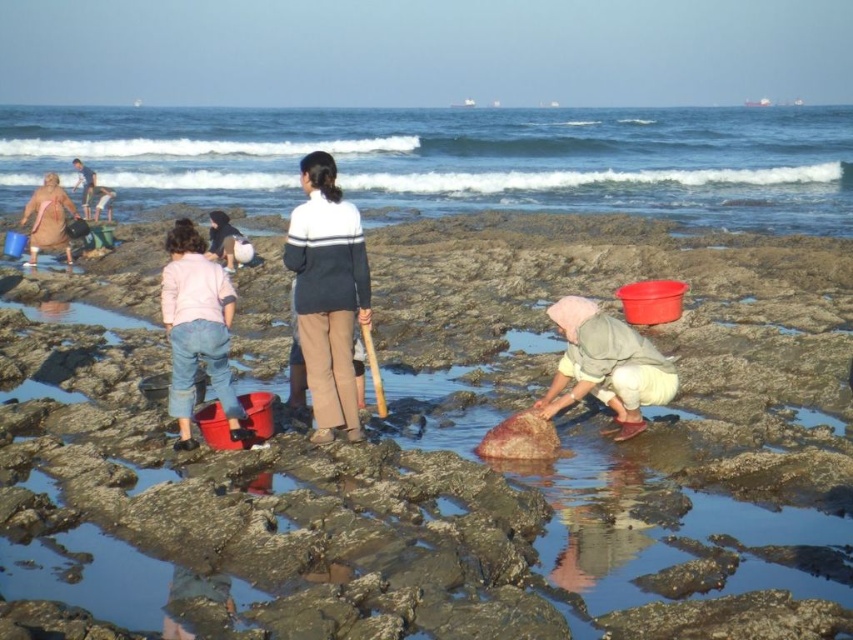
Is the position of clear blue water at upper center more distant than that of matte pink towel at left?

Yes, it is.

Does clear blue water at upper center have a larger size compared to matte pink towel at left?

Indeed, clear blue water at upper center has a larger size compared to matte pink towel at left.

Between point (352, 145) and point (39, 216), which one is positioned in front?

Positioned in front is point (39, 216).

The height and width of the screenshot is (640, 853). What are the coordinates of `clear blue water at upper center` in the screenshot? It's located at (457, 160).